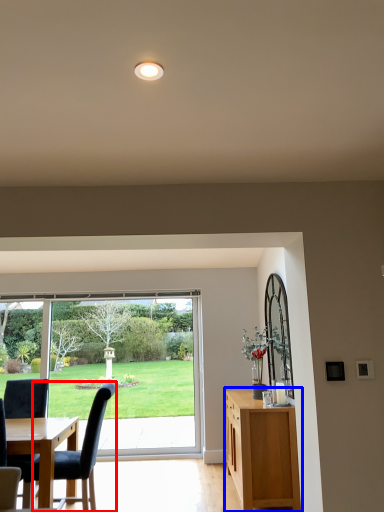
Question: Which of the following is the closest to the observer, chair (highlighted by a red box) or cabinetry (highlighted by a blue box)?

Choices:
 (A) chair
 (B) cabinetry

Answer: (A)